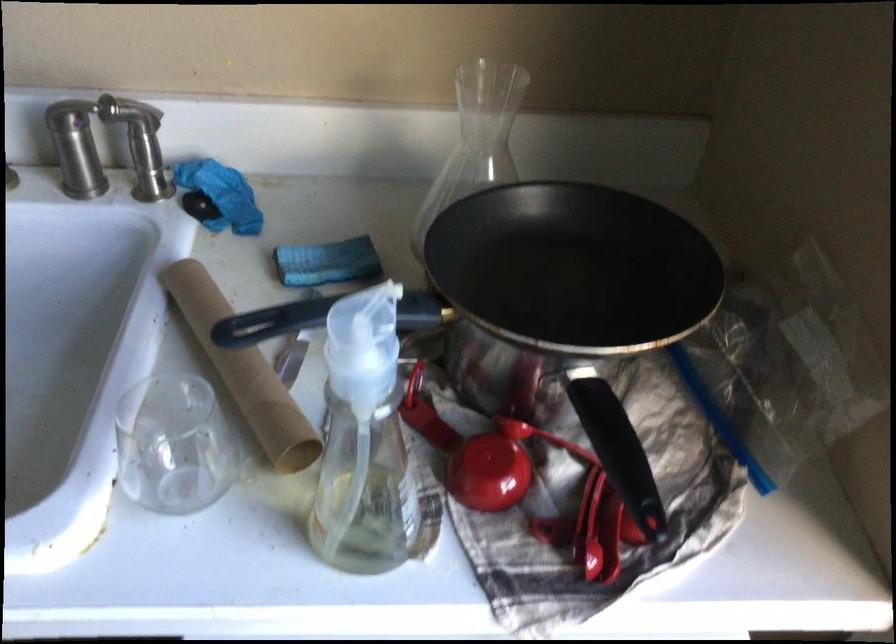
Where would you grasp the cardboard tube? Please return your answer as a coordinate pair (x, y).

(243, 371)